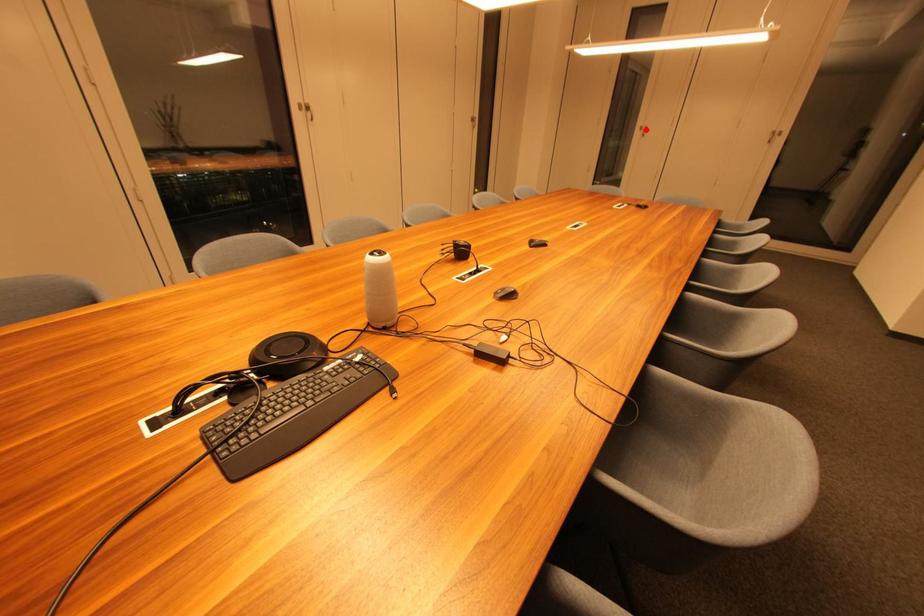
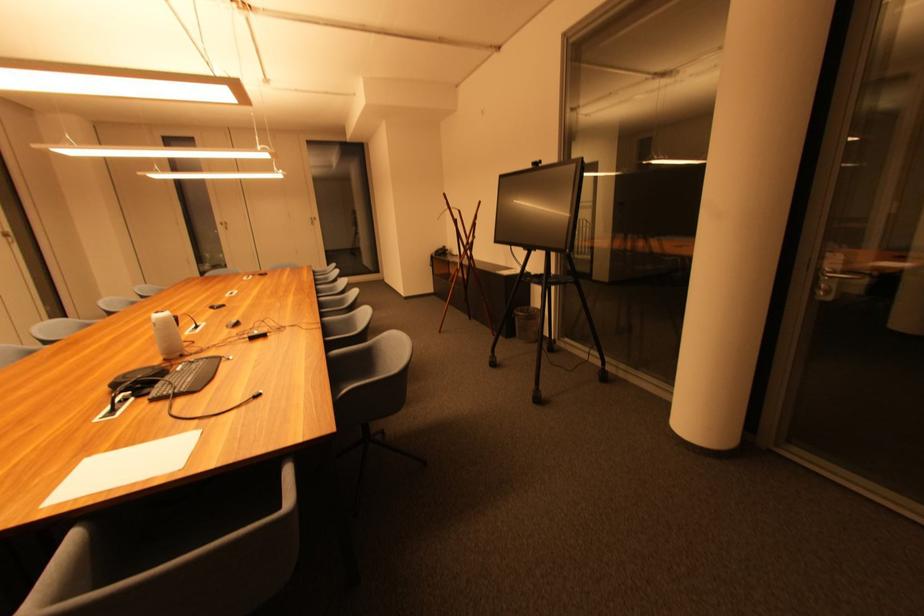
Where in the second image is the point corresponding to the highlighted location from the first image?

(226, 225)